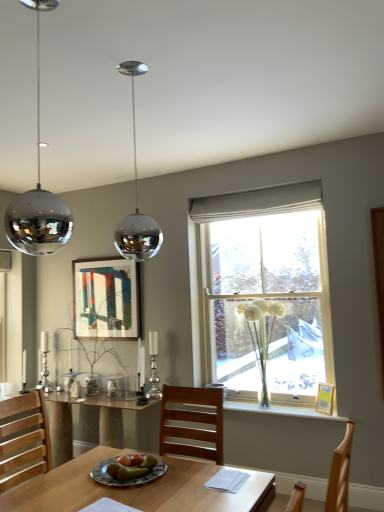
Question: Visually, is white fluffy flowers at window positioned to the left or to the right of white glass vase at center?

Choices:
 (A) left
 (B) right

Answer: (A)

Question: In terms of width, does white fluffy flowers at window look wider or thinner when compared to white glass vase at center?

Choices:
 (A) thin
 (B) wide

Answer: (B)

Question: Which is nearer to the green matte plate at center?

Choices:
 (A) clear glass vase at center
 (B) matte wooden picture frame at upper center, marked as the 2th picture frame in a bottom-to-top arrangement
 (C) white fabric curtain at upper center
 (D) wooden table at lower left
 (E) white fluffy flowers at window

Answer: (D)

Question: Estimate the real-world distances between objects in this image. Which object is closer to the matte wooden picture frame at upper center, the 1th picture frame positioned from the top?

Choices:
 (A) white glass vase at center
 (B) polished chrome sphere at center
 (C) green matte plate at center
 (D) wooden picture frame at window, the 2th picture frame viewed from the left
 (E) white fluffy flowers at window

Answer: (E)